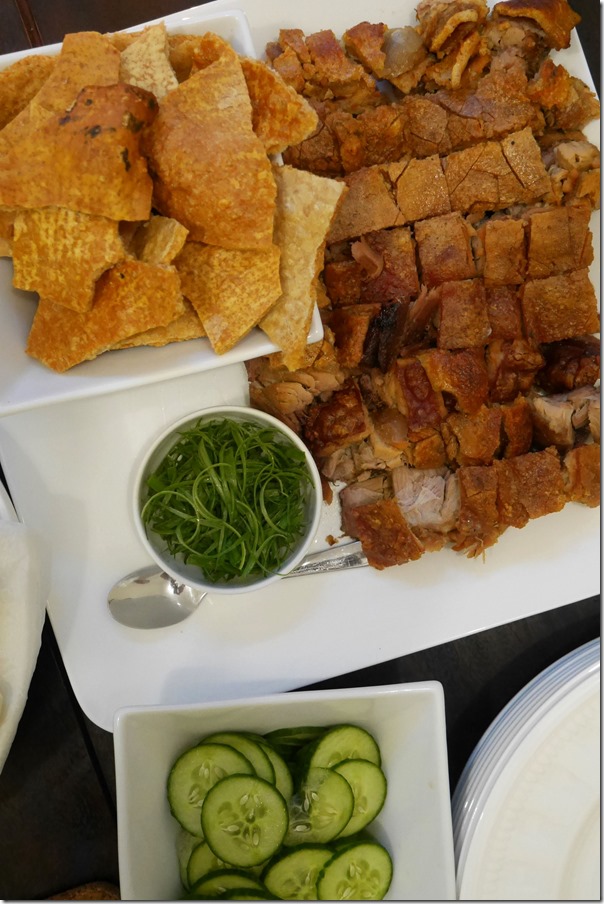
At what (x,y) coordinates should I click in order to perform the action: click on small bowl. Please return your answer as a coordinate pair (x, y). Looking at the image, I should click on pos(304,552).